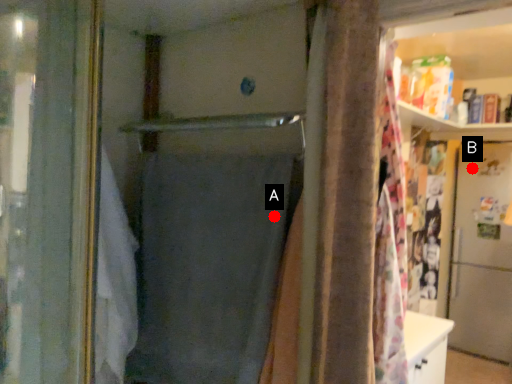
Question: Two points are circled on the image, labeled by A and B beside each circle. Which point is farther from the camera taking this photo?

Choices:
 (A) A is further
 (B) B is further

Answer: (B)